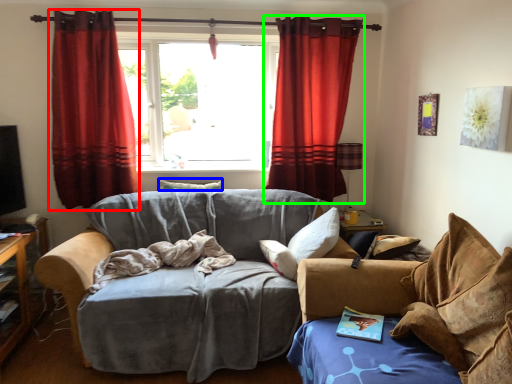
Question: Which object is the closest to the curtain (highlighted by a red box)? Choose among these: pillow (highlighted by a blue box) or curtain (highlighted by a green box).

Choices:
 (A) pillow
 (B) curtain

Answer: (A)